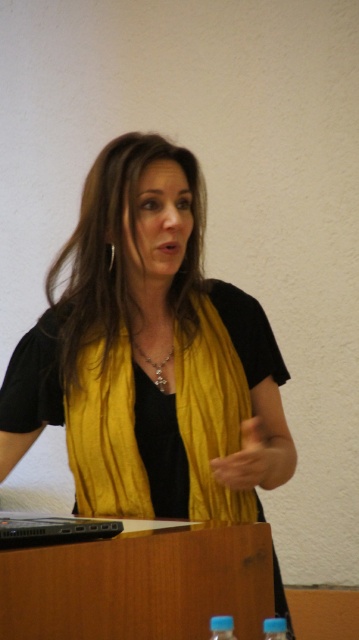
Question: Can you confirm if black plastic laptop at lower left is positioned above blue plastic bottle at lower center?

Choices:
 (A) yes
 (B) no

Answer: (A)

Question: Which point is farther to the camera?

Choices:
 (A) (127, 440)
 (B) (171, 348)
 (C) (269, 445)
 (D) (226, 637)

Answer: (B)

Question: Considering the relative positions of yellow fabric hand at center and silver/glass necklace at center in the image provided, where is yellow fabric hand at center located with respect to silver/glass necklace at center?

Choices:
 (A) right
 (B) left

Answer: (A)

Question: Can you confirm if black plastic laptop at lower left is thinner than transparent plastic bottle at lower right?

Choices:
 (A) no
 (B) yes

Answer: (A)

Question: Among these objects, which one is farthest from the camera?

Choices:
 (A) silver/glass necklace at center
 (B) yellow silk scarf at center
 (C) blue plastic bottle at lower center
 (D) transparent plastic bottle at lower right

Answer: (A)

Question: Based on their relative distances, which object is farther from the black plastic laptop at lower left?

Choices:
 (A) yellow silk scarf at center
 (B) yellow fabric hand at center
 (C) blue plastic bottle at lower center
 (D) transparent plastic bottle at lower right

Answer: (A)